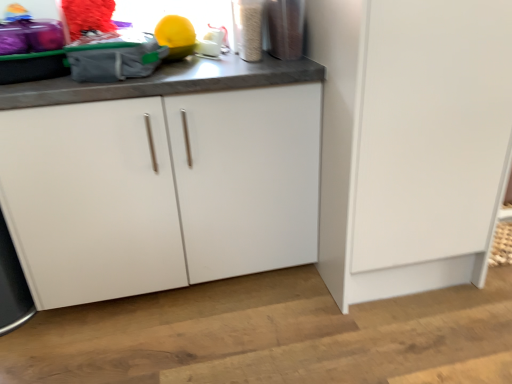
Locate an element on the screen. white matte cabinet at center is located at coordinates (161, 190).

Locate an element on the screen. The image size is (512, 384). metallic silver container at upper right, positioned as the second appliance in left-to-right order is located at coordinates (286, 28).

Describe the element at coordinates (429, 145) in the screenshot. I see `white matte cabinet door at lower right` at that location.

This screenshot has width=512, height=384. In order to click on white matte cabinet at center in this screenshot , I will do `click(161, 190)`.

Between metallic silver canister at upper right, the 1th appliance in the left-to-right sequence, and white matte cabinet at center, which one has larger size?

white matte cabinet at center is bigger.

This screenshot has width=512, height=384. Identify the location of cabinetry located underneath the metallic silver canister at upper right, positioned as the second appliance in right-to-left order (from a real-world perspective). (161, 190).

Is metallic silver canister at upper right, the 1th appliance in the left-to-right sequence, far from white matte cabinet at center?

metallic silver canister at upper right, the 1th appliance in the left-to-right sequence, is near white matte cabinet at center, not far away.

Who is bigger, white matte cabinet at center or white matte cabinet door at lower right?

white matte cabinet door at lower right.

Relative to white matte cabinet door at lower right, is white matte cabinet at center in front or behind?

Visually, white matte cabinet at center is located behind white matte cabinet door at lower right.

How far apart are white matte cabinet at center and white matte cabinet door at lower right?

The distance of white matte cabinet at center from white matte cabinet door at lower right is 19.91 inches.

Considering the sizes of objects white matte cabinet at center and white matte cabinet door at lower right in the image provided, who is thinner, white matte cabinet at center or white matte cabinet door at lower right?

Thinner between the two is white matte cabinet at center.

Between point (396, 189) and point (280, 54), which one is positioned in front?

The point (396, 189) is closer.

Between white matte cabinet door at lower right and metallic silver container at upper right, placed as the first appliance when sorted from right to left, which one appears on the left side from the viewer's perspective?

Positioned to the left is metallic silver container at upper right, placed as the first appliance when sorted from right to left.

From the picture: Is white matte cabinet door at lower right positioned with its back to metallic silver container at upper right, positioned as the second appliance in left-to-right order?

No, white matte cabinet door at lower right is not facing away from metallic silver container at upper right, positioned as the second appliance in left-to-right order.

Does white matte cabinet door at lower right have a greater width compared to metallic silver container at upper right, positioned as the second appliance in left-to-right order?

Indeed, white matte cabinet door at lower right has a greater width compared to metallic silver container at upper right, positioned as the second appliance in left-to-right order.

Would you say metallic silver container at upper right, placed as the first appliance when sorted from right to left, is a long distance from metallic silver canister at upper right, the 1th appliance in the left-to-right sequence?

metallic silver container at upper right, placed as the first appliance when sorted from right to left, is near metallic silver canister at upper right, the 1th appliance in the left-to-right sequence, not far away.

Between metallic silver container at upper right, positioned as the second appliance in left-to-right order, and metallic silver canister at upper right, the 1th appliance in the left-to-right sequence, which one is positioned in front?

metallic silver canister at upper right, the 1th appliance in the left-to-right sequence, is closer to the camera.

Which of these two, metallic silver canister at upper right, the 1th appliance in the left-to-right sequence, or metallic silver container at upper right, positioned as the second appliance in left-to-right order, stands taller?

metallic silver canister at upper right, the 1th appliance in the left-to-right sequence, is taller.

Is metallic silver canister at upper right, the 1th appliance in the left-to-right sequence, facing away from metallic silver container at upper right, placed as the first appliance when sorted from right to left?

That's not correct — metallic silver canister at upper right, the 1th appliance in the left-to-right sequence, is not looking away from metallic silver container at upper right, placed as the first appliance when sorted from right to left.

Between metallic silver canister at upper right, positioned as the second appliance in right-to-left order, and metallic silver container at upper right, positioned as the second appliance in left-to-right order, which one has smaller size?

metallic silver canister at upper right, positioned as the second appliance in right-to-left order, is smaller.

Does white matte cabinet at center have a greater height compared to metallic silver container at upper right, positioned as the second appliance in left-to-right order?

Yes.

Can you confirm if white matte cabinet at center is wider than metallic silver container at upper right, placed as the first appliance when sorted from right to left?

Yes.

Would you say metallic silver container at upper right, placed as the first appliance when sorted from right to left, is part of white matte cabinet at center's contents?

Actually, metallic silver container at upper right, placed as the first appliance when sorted from right to left, is outside white matte cabinet at center.

From a real-world perspective, between white matte cabinet at center and metallic silver container at upper right, positioned as the second appliance in left-to-right order, who is vertically lower?

white matte cabinet at center.

From the image's perspective, is white matte cabinet door at lower right beneath metallic silver canister at upper right, the 1th appliance in the left-to-right sequence?

Correct, white matte cabinet door at lower right appears lower than metallic silver canister at upper right, the 1th appliance in the left-to-right sequence, in the image.

Is there a large distance between white matte cabinet door at lower right and metallic silver canister at upper right, the 1th appliance in the left-to-right sequence?

No, there isn't a large distance between white matte cabinet door at lower right and metallic silver canister at upper right, the 1th appliance in the left-to-right sequence.

Would you say white matte cabinet door at lower right is to the left or to the right of metallic silver canister at upper right, positioned as the second appliance in right-to-left order, in the picture?

From the image, it's evident that white matte cabinet door at lower right is to the right of metallic silver canister at upper right, positioned as the second appliance in right-to-left order.

Is white matte cabinet door at lower right aimed at metallic silver canister at upper right, positioned as the second appliance in right-to-left order?

No, white matte cabinet door at lower right is not facing towards metallic silver canister at upper right, positioned as the second appliance in right-to-left order.

Find the location of a particular element. Image resolution: width=512 pixels, height=384 pixels. cabinetry beneath the metallic silver canister at upper right, positioned as the second appliance in right-to-left order (from a real-world perspective) is located at coordinates (161, 190).

Locate an element on the screen. The height and width of the screenshot is (384, 512). cabinetry below the white matte cabinet door at lower right (from the image's perspective) is located at coordinates (161, 190).

Based on their spatial positions, is white matte cabinet at center or white matte cabinet door at lower right closer to metallic silver container at upper right, placed as the first appliance when sorted from right to left?

Based on the image, white matte cabinet at center appears to be nearer to metallic silver container at upper right, placed as the first appliance when sorted from right to left.

Which object lies nearer to the anchor point metallic silver container at upper right, placed as the first appliance when sorted from right to left, metallic silver canister at upper right, the 1th appliance in the left-to-right sequence, or white matte cabinet door at lower right?

The object closer to metallic silver container at upper right, placed as the first appliance when sorted from right to left, is metallic silver canister at upper right, the 1th appliance in the left-to-right sequence.

Based on their spatial positions, is metallic silver container at upper right, positioned as the second appliance in left-to-right order, or white matte cabinet door at lower right further from metallic silver canister at upper right, the 1th appliance in the left-to-right sequence?

white matte cabinet door at lower right is further to metallic silver canister at upper right, the 1th appliance in the left-to-right sequence.

When comparing their distances from metallic silver container at upper right, placed as the first appliance when sorted from right to left, does metallic silver canister at upper right, the 1th appliance in the left-to-right sequence, or white matte cabinet at center seem further?

The object further to metallic silver container at upper right, placed as the first appliance when sorted from right to left, is white matte cabinet at center.

Considering their positions, is metallic silver canister at upper right, the 1th appliance in the left-to-right sequence, positioned closer to white matte cabinet at center than white matte cabinet door at lower right?

white matte cabinet door at lower right lies closer to white matte cabinet at center than the other object.

From the image, which object appears to be farther from metallic silver canister at upper right, positioned as the second appliance in right-to-left order, white matte cabinet door at lower right or white matte cabinet at center?

Based on the image, white matte cabinet door at lower right appears to be further to metallic silver canister at upper right, positioned as the second appliance in right-to-left order.

Estimate the real-world distances between objects in this image. Which object is closer to white matte cabinet door at lower right, white matte cabinet at center or metallic silver container at upper right, positioned as the second appliance in left-to-right order?

white matte cabinet at center.

Looking at the image, which one is located closer to white matte cabinet at center, metallic silver container at upper right, positioned as the second appliance in left-to-right order, or metallic silver canister at upper right, positioned as the second appliance in right-to-left order?

metallic silver canister at upper right, positioned as the second appliance in right-to-left order.

Identify the location of appliance between metallic silver canister at upper right, the 1th appliance in the left-to-right sequence, and white matte cabinet door at lower right, in the horizontal direction. This screenshot has height=384, width=512. tap(286, 28).

Identify the location of appliance between metallic silver canister at upper right, the 1th appliance in the left-to-right sequence, and white matte cabinet at center vertically. (286, 28).